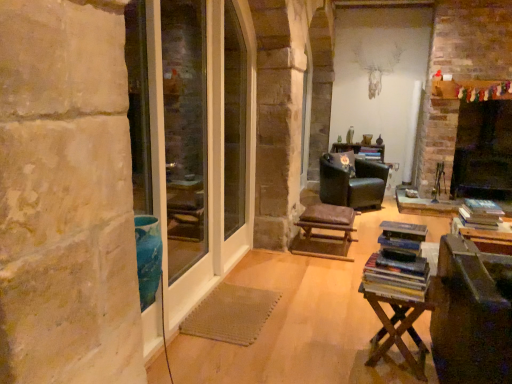
I want to click on free spot in front of clear glass screen door at left, marked as the 1th screen door in a right-to-left arrangement, so click(230, 336).